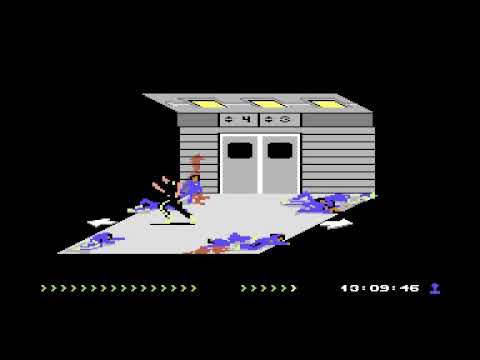
The height and width of the screenshot is (360, 480). Identify the location of door. click(x=248, y=169), click(x=276, y=172).